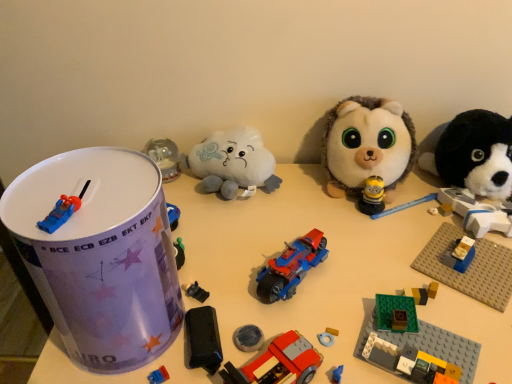
At what (x,y) coordinates should I click in order to perform the action: click on free space between black plush dog at right, positioned as the 1th toy in right-to-left order, and green plastic building block at lower right, which is the 7th toy from left to right. Please return your answer as a coordinate pair (x, y). The width and height of the screenshot is (512, 384). Looking at the image, I should click on (430, 259).